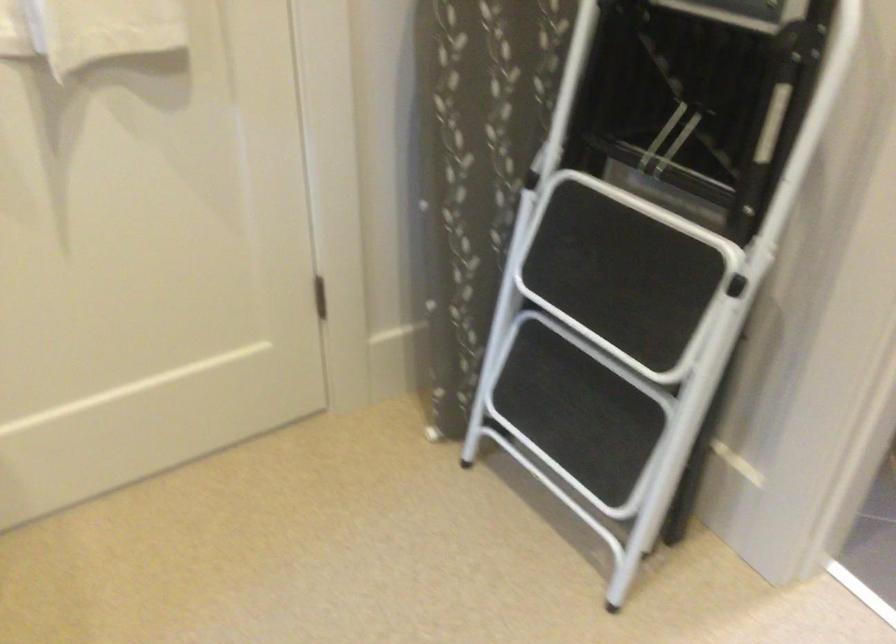
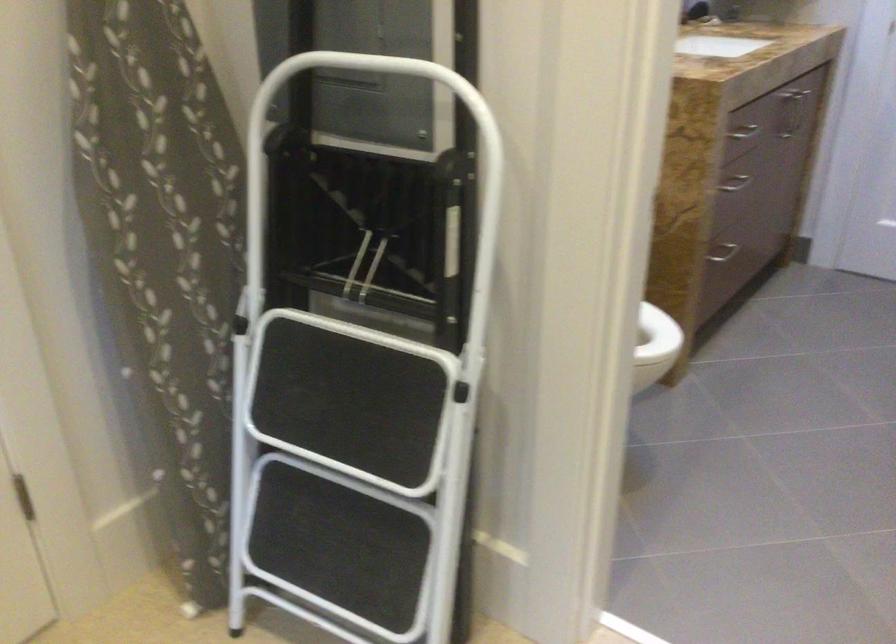
Question: The camera is either moving clockwise (left) or counter-clockwise (right) around the object. The first image is from the beginning of the video and the second image is from the end. Is the camera moving left or right when shooting the video?

Choices:
 (A) Left
 (B) Right

Answer: (A)